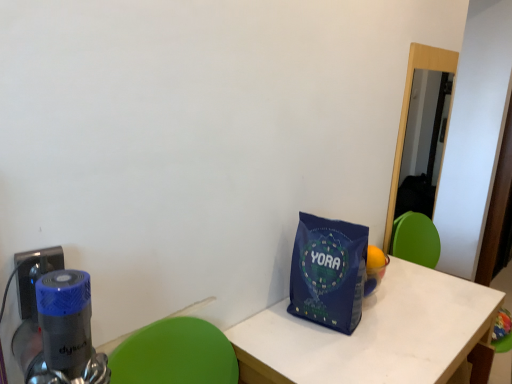
At what (x,y) coordinates should I click in order to perform the action: click on free point in front of blue fabric tote bag at lower right. Please return your answer as a coordinate pair (x, y). This screenshot has width=512, height=384. Looking at the image, I should click on (332, 352).